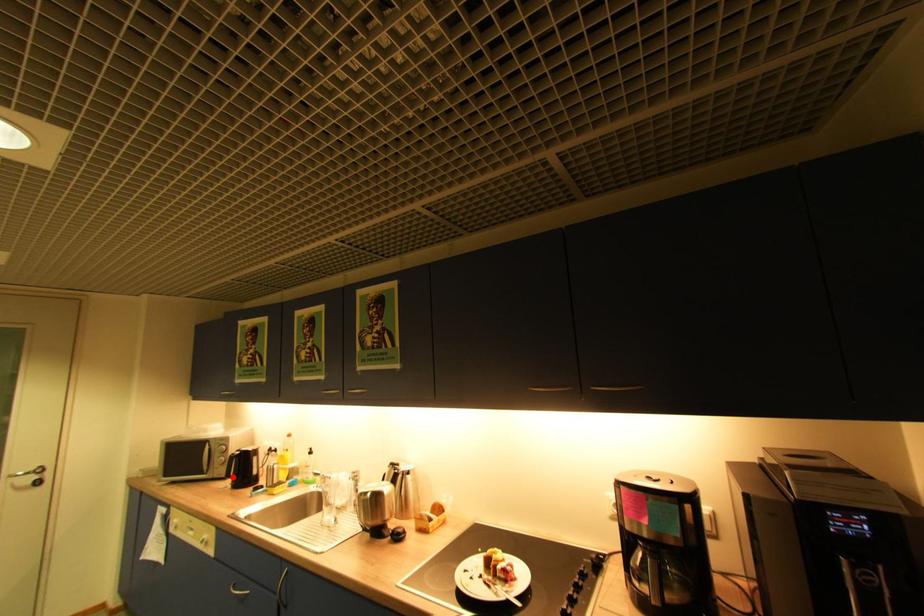
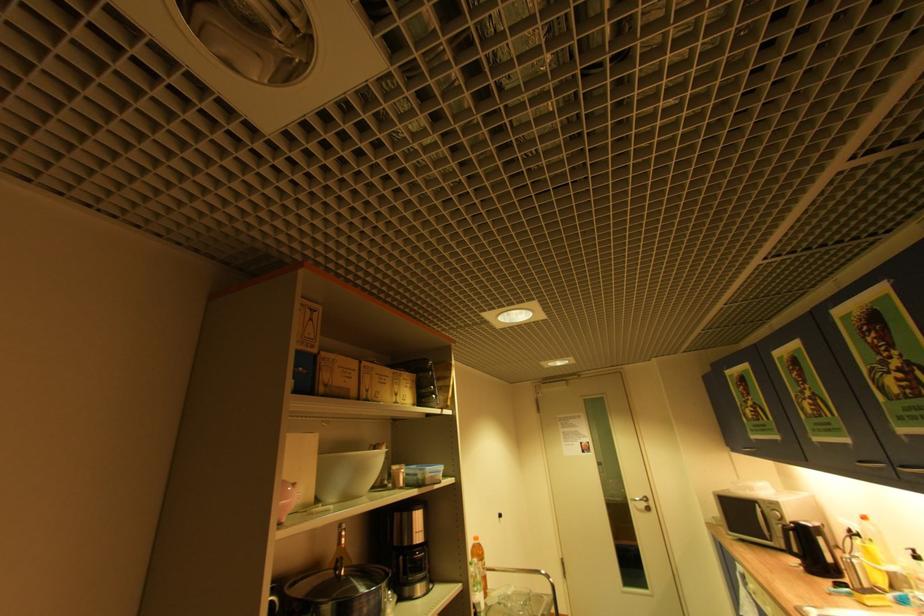
Question: I am providing you with two images of the same scene from different viewpoints. Given a red point in image1, look at the same physical point in image2. Is it:

Choices:
 (A) Closer to the viewpoint
 (B) Farther from the viewpoint

Answer: (A)